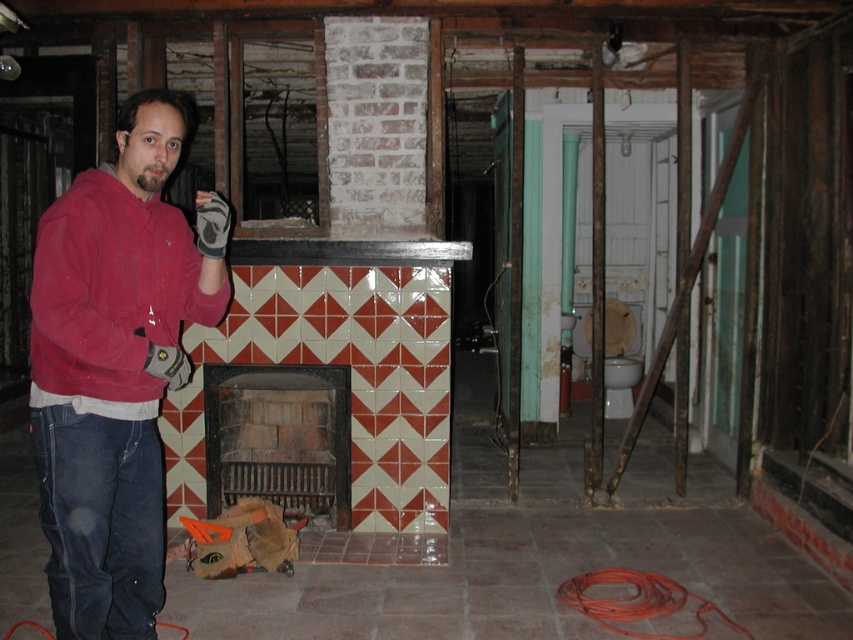
Does matte red hoodie at left appear on the right side of red brick fireplace at center?

In fact, matte red hoodie at left is to the left of red brick fireplace at center.

Between matte red hoodie at left and red brick fireplace at center, which one appears on the left side from the viewer's perspective?

matte red hoodie at left is more to the left.

Does point (79, 180) come behind point (328, 413)?

No, it is not.

I want to click on matte red hoodie at left, so pos(115,365).